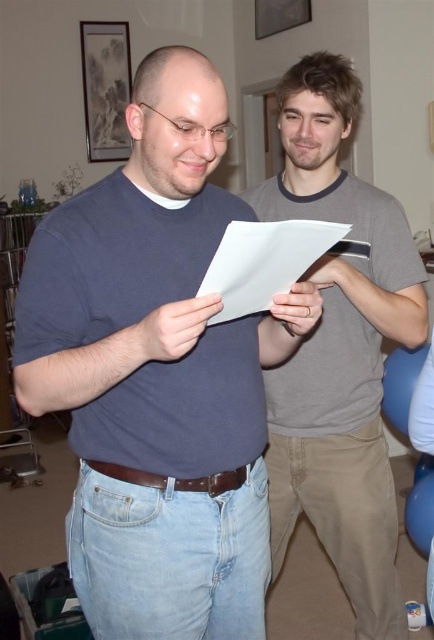
Based on the coordinates provided, which object is located at point (157, 374)?

The point (157, 374) indicates the matte blue shirt at center.